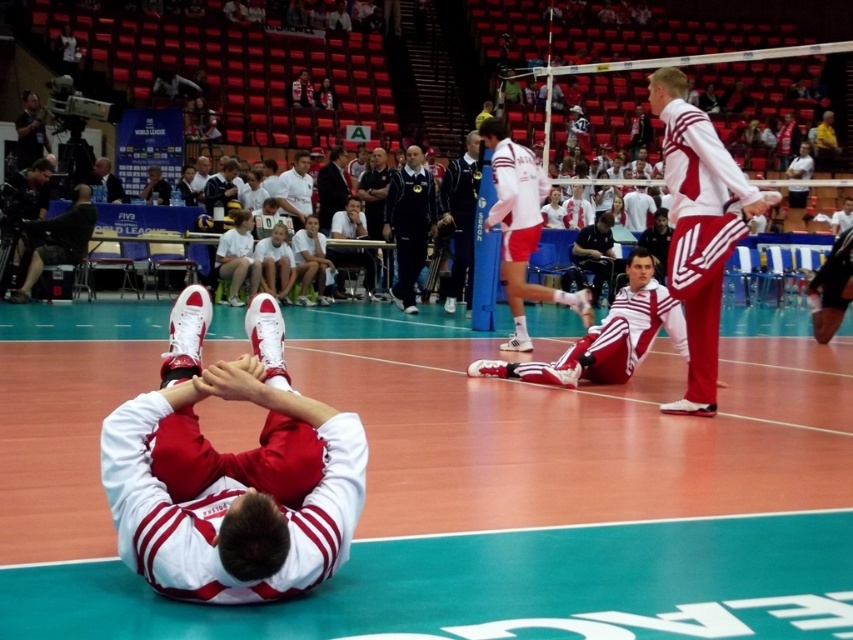
Does point (552, 333) lie behind point (291, 176)?

No, it is not.

Who is positioned more to the left, green vinyl court at center or white matte shirt at center?

white matte shirt at center

Identify the location of green vinyl court at center. The width and height of the screenshot is (853, 640). (534, 499).

Does white matte tracksuit at upper right lie in front of matte black camera at upper left?

Yes, white matte tracksuit at upper right is closer to the viewer.

Is point (735, 170) positioned before point (33, 122)?

Yes, it is.

Is point (701, 157) closer to camera compared to point (32, 157)?

Yes, it is.

This screenshot has width=853, height=640. I want to click on white matte tracksuit at upper right, so click(698, 227).

Is matte white sneakers at center smaller than matte black camera at upper left?

No.

Image resolution: width=853 pixels, height=640 pixels. Describe the element at coordinates (231, 477) in the screenshot. I see `matte white sneakers at center` at that location.

The height and width of the screenshot is (640, 853). I want to click on matte white sneakers at center, so click(x=231, y=477).